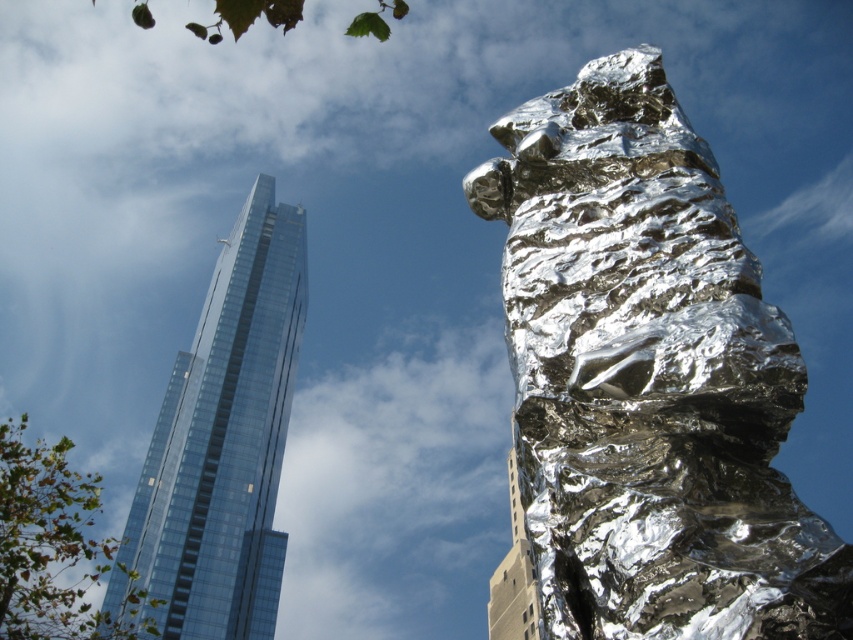
You are an architect evaluating the spatial relationship between the shiny metallic rock at center and the beige concrete building at center. Which object occupies a larger area in the image?

The beige concrete building at center is larger than the shiny metallic rock at center, so it occupies a larger area in the image.

You are an architect evaluating the cityscape. Which object in the scene is shorter, the shiny metallic rock at center or the transparent glass skyscraper at upper left?

The shiny metallic rock at center is shorter than the transparent glass skyscraper at upper left.

You are a photographer planning to capture the shiny metallic rock at center and the transparent glass skyscraper at upper left in a single shot. Based on their positions, which object is positioned to the right side of the other?

The shiny metallic rock at center is to the right of the transparent glass skyscraper at upper left.